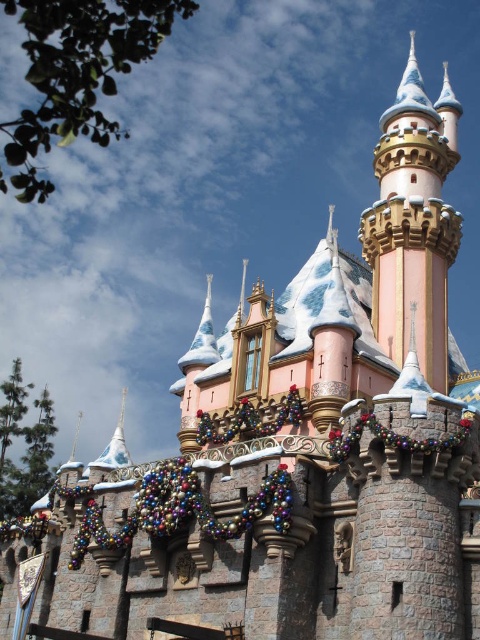
Question: Considering the relative positions of pink stone castle tower at upper right and metallic garland at center in the image provided, where is pink stone castle tower at upper right located with respect to metallic garland at center?

Choices:
 (A) left
 (B) right

Answer: (B)

Question: Which of the following is the closest to the observer?

Choices:
 (A) pink stone castle tower at upper right
 (B) metallic garland at center
 (C) multicolored glass garland at lower center

Answer: (C)

Question: Which point is closer to the camera?

Choices:
 (A) (278, 416)
 (B) (186, 458)

Answer: (B)

Question: Which point appears closest to the camera in this image?

Choices:
 (A) (206, 413)
 (B) (408, 300)
 (C) (277, 508)

Answer: (C)

Question: Does pink stone castle tower at upper right have a greater width compared to metallic garland at center?

Choices:
 (A) no
 (B) yes

Answer: (B)

Question: Does pink stone castle tower at upper right have a larger size compared to metallic garland at center?

Choices:
 (A) no
 (B) yes

Answer: (B)